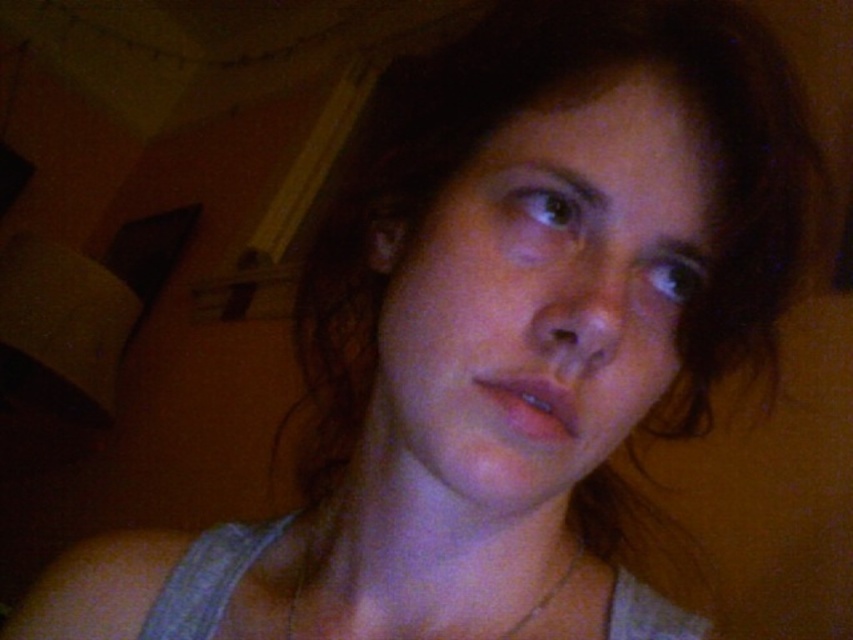
Question: Is smooth skin face at center closer to the viewer compared to silver metallic chain at center?

Choices:
 (A) no
 (B) yes

Answer: (B)

Question: Observing the image, what is the correct spatial positioning of smooth skin face at center in reference to silver metallic chain at center?

Choices:
 (A) right
 (B) left

Answer: (A)

Question: Is smooth skin face at center to the left of silver metallic chain at center from the viewer's perspective?

Choices:
 (A) no
 (B) yes

Answer: (A)

Question: Which point is farther from the camera taking this photo?

Choices:
 (A) (682, 256)
 (B) (511, 628)

Answer: (B)